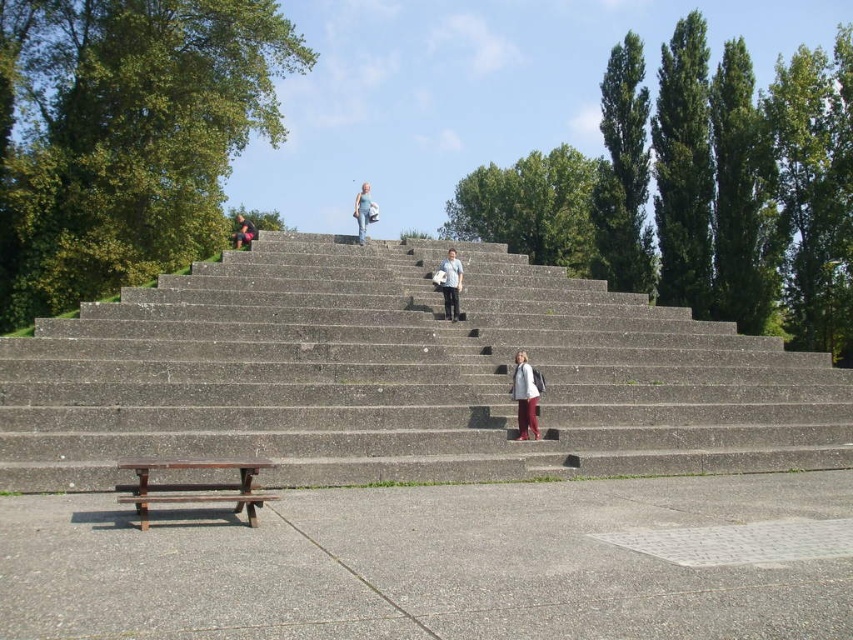
Question: Where is wooden bench at lower left located in relation to matte black jacket at upper center in the image?

Choices:
 (A) above
 (B) below

Answer: (B)

Question: Which object is positioned closest to the matte black jacket at upper center?

Choices:
 (A) light gray concrete steps at center
 (B) wooden bench at lower left
 (C) denim jeans at upper center

Answer: (A)

Question: Based on their relative distances, which object is nearer to the wooden bench at lower left?

Choices:
 (A) concrete stairs at center
 (B) matte black jacket at upper center
 (C) denim jeans at upper center

Answer: (A)

Question: Which of the following is the farthest from the observer?

Choices:
 (A) matte white jacket at center
 (B) denim jeans at upper center
 (C) matte black jacket at upper center

Answer: (C)

Question: Can you confirm if concrete stairs at center is positioned to the right of denim jeans at upper center?

Choices:
 (A) no
 (B) yes

Answer: (B)

Question: Can you confirm if concrete stairs at center is thinner than wooden bench at lower left?

Choices:
 (A) no
 (B) yes

Answer: (A)